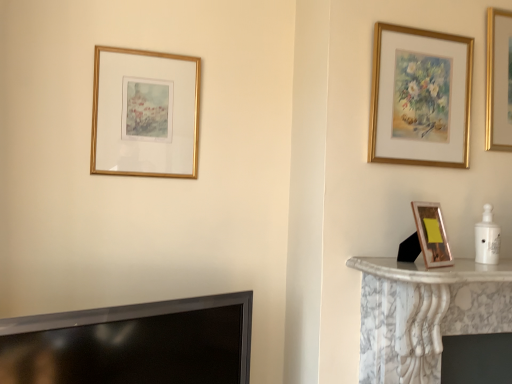
Question: Can you confirm if gold-framed picture at upper left, marked as the first picture frame in a back-to-front arrangement, is thinner than gold-framed painting at upper right, which ranks as the second picture frame in back-to-front order?

Choices:
 (A) yes
 (B) no

Answer: (A)

Question: Is gold-framed picture at upper left, the third picture frame positioned from the front, facing away from gold-framed painting at upper right, which is counted as the 2th picture frame, starting from the front?

Choices:
 (A) yes
 (B) no

Answer: (B)

Question: Is gold-framed picture at upper left, which is the first picture frame in left-to-right order, to the left of gold-framed painting at upper right, which ranks as the second picture frame in back-to-front order, from the viewer's perspective?

Choices:
 (A) yes
 (B) no

Answer: (A)

Question: From a real-world perspective, does gold-framed picture at upper left, which is the first picture frame in left-to-right order, sit lower than gold-framed painting at upper right, the 3th picture frame in the left-to-right sequence?

Choices:
 (A) no
 (B) yes

Answer: (B)

Question: From the image's perspective, is gold-framed picture at upper left, marked as the third picture frame in a right-to-left arrangement, beneath gold-framed painting at upper right, which is counted as the 2th picture frame, starting from the front?

Choices:
 (A) yes
 (B) no

Answer: (A)

Question: Is gold-framed picture at upper left, marked as the third picture frame in a right-to-left arrangement, inside or outside of gold-framed painting at upper right, the 3th picture frame in the left-to-right sequence?

Choices:
 (A) inside
 (B) outside

Answer: (B)

Question: Considering the positions of gold-framed picture at upper left, the third picture frame positioned from the front, and gold-framed painting at upper right, which is counted as the 2th picture frame, starting from the front, in the image, is gold-framed picture at upper left, the third picture frame positioned from the front, wider or thinner than gold-framed painting at upper right, which is counted as the 2th picture frame, starting from the front,?

Choices:
 (A) thin
 (B) wide

Answer: (A)

Question: Would you say gold-framed picture at upper left, marked as the third picture frame in a right-to-left arrangement, is to the left or to the right of gold-framed painting at upper right, which is counted as the 2th picture frame, starting from the front, in the picture?

Choices:
 (A) left
 (B) right

Answer: (A)

Question: Considering the positions of gold-framed picture at upper left, which is the first picture frame in left-to-right order, and gold-framed painting at upper right, which appears as the first picture frame when viewed from the right, in the image, is gold-framed picture at upper left, which is the first picture frame in left-to-right order, bigger or smaller than gold-framed painting at upper right, which appears as the first picture frame when viewed from the right,?

Choices:
 (A) small
 (B) big

Answer: (A)

Question: Is gold metallic picture frame at right, which ranks as the 2th picture frame in left-to-right order, inside or outside of gold-framed picture at upper left, which is the first picture frame in left-to-right order?

Choices:
 (A) outside
 (B) inside

Answer: (A)

Question: From a real-world perspective, is gold metallic picture frame at right, the second picture frame from the right, physically located above or below gold-framed picture at upper left, marked as the first picture frame in a back-to-front arrangement?

Choices:
 (A) above
 (B) below

Answer: (B)

Question: Considering the positions of gold metallic picture frame at right, which is counted as the 1th picture frame, starting from the front, and gold-framed picture at upper left, marked as the third picture frame in a right-to-left arrangement, in the image, is gold metallic picture frame at right, which is counted as the 1th picture frame, starting from the front, bigger or smaller than gold-framed picture at upper left, marked as the third picture frame in a right-to-left arrangement,?

Choices:
 (A) big
 (B) small

Answer: (B)

Question: In the image, is gold metallic picture frame at right, which ranks as the 2th picture frame in left-to-right order, positioned in front of or behind gold-framed picture at upper left, marked as the third picture frame in a right-to-left arrangement?

Choices:
 (A) front
 (B) behind

Answer: (A)

Question: Relative to black glossy tv at lower left, is gold metallic picture frame at right, which ranks as the 2th picture frame in left-to-right order, in front or behind?

Choices:
 (A) behind
 (B) front

Answer: (A)

Question: From the image's perspective, is gold metallic picture frame at right, which is counted as the 1th picture frame, starting from the front, above or below black glossy tv at lower left?

Choices:
 (A) below
 (B) above

Answer: (B)